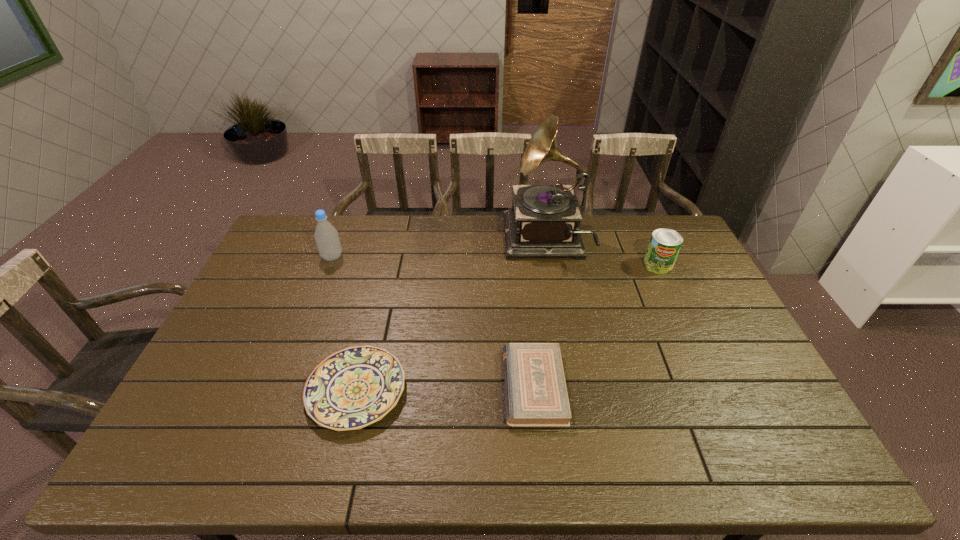
The image size is (960, 540). What are the coordinates of `vacant space that satisfies the following two spatial constraints: 1. on the front side of the third shortest object; 2. on the left side of the fourth shortest object` in the screenshot? It's located at (329, 265).

In order to click on blank space that satisfies the following two spatial constraints: 1. on the horn of the tallest object; 2. on the right side of the rightmost object in this screenshot , I will do `click(549, 265)`.